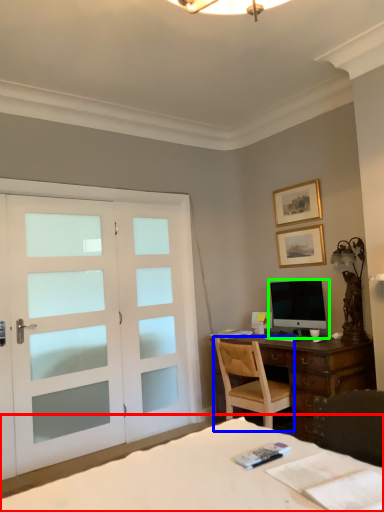
Question: Which object is positioned farthest from bed (highlighted by a red box)? Select from chair (highlighted by a blue box) and computer monitor (highlighted by a green box).

Choices:
 (A) chair
 (B) computer monitor

Answer: (B)